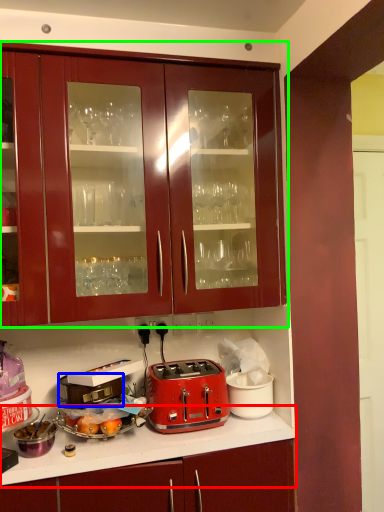
Question: Which object is positioned closest to countertop (highlighted by a red box)? Select from appliance (highlighted by a blue box) and cabinetry (highlighted by a green box).

Choices:
 (A) appliance
 (B) cabinetry

Answer: (A)